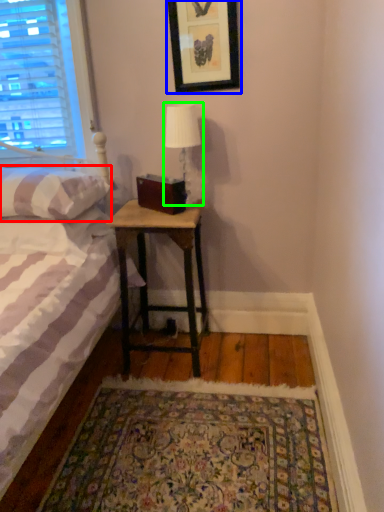
Question: Considering the real-world distances, which object is farthest from pillow (highlighted by a red box)? picture frame (highlighted by a blue box) or table lamp (highlighted by a green box)?

Choices:
 (A) picture frame
 (B) table lamp

Answer: (A)